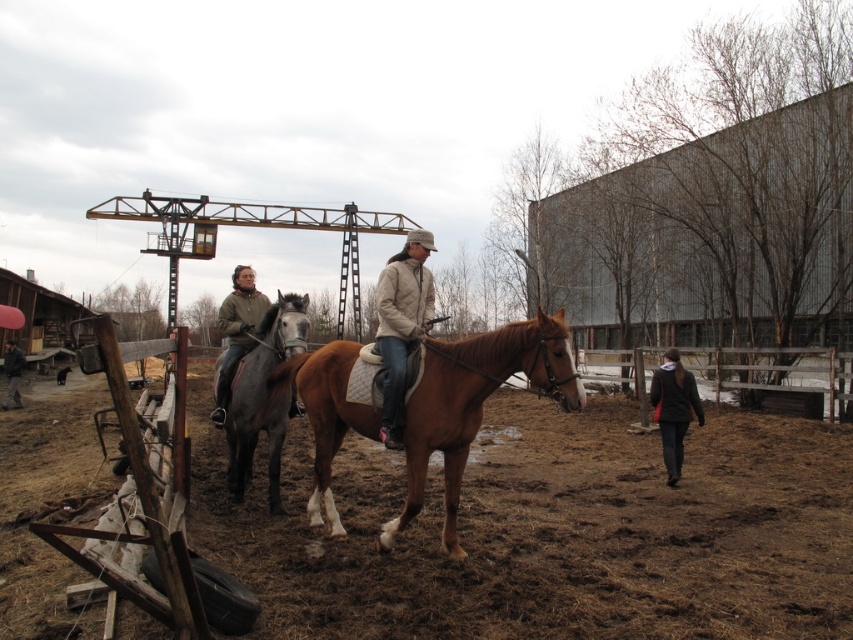
You are a photographer trying to capture both riders in a single shot. Since you want to focus on their jackets, which dark brown leather jacket at left and dark brown leather jacket at lower left, which one should you adjust your camera angle to prioritize if you want to include both without cropping?

The dark brown leather jacket at left is located above the dark brown leather jacket at lower left, so to include both without cropping, prioritize focusing on the dark brown leather jacket at left first as it is higher in the frame.

You are standing at the origin point in the image. There is a dark brown leather jacket at left represented by point (236, 330). What is the coordinate of the dark brown leather jacket at left?

The dark brown leather jacket at left is represented by point (236, 330).